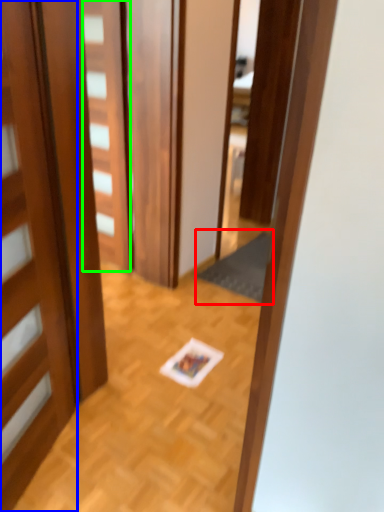
Question: Estimate the real-world distances between objects in this image. Which object is farther from doormat (highlighted by a red box), door (highlighted by a blue box) or door (highlighted by a green box)?

Choices:
 (A) door
 (B) door

Answer: (A)